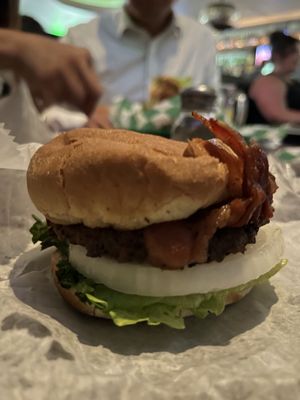
The width and height of the screenshot is (300, 400). Identify the location of tablecloth. (53, 319).